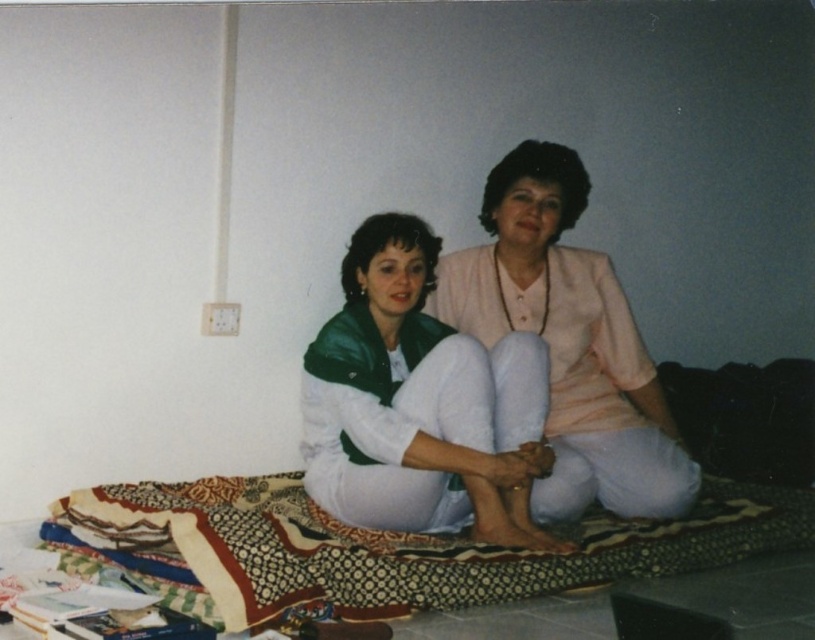
You are a photographer setting up a shoot in this room. You need to ensure that the matte pink blouse at center and the light pink fabric at center are both visible in the frame. Based on their positions, which one should you focus on to make sure the other is still in the background?

The matte pink blouse at center is in front of the light pink fabric at center. To ensure the light pink fabric at center remains visible in the background, focus on the matte pink blouse at center so the fabric stays in the background.